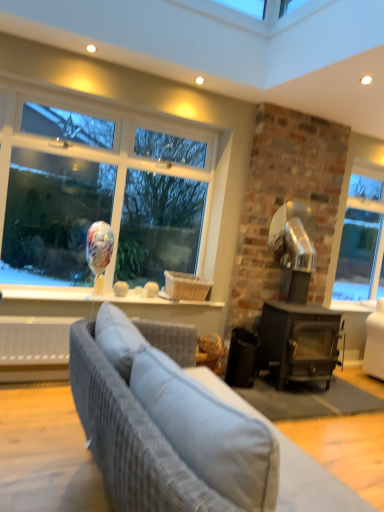
Where is `textured gray fabric couch at lower left`? textured gray fabric couch at lower left is located at coordinates (130, 438).

What do you see at coordinates (130, 438) in the screenshot? This screenshot has height=512, width=384. I see `textured gray fabric couch at lower left` at bounding box center [130, 438].

What is the approximate width of dark gray wood stove at right?

23.01 inches.

Describe the element at coordinates (297, 306) in the screenshot. I see `dark gray wood stove at right` at that location.

The height and width of the screenshot is (512, 384). I want to click on dark gray wood stove at right, so click(297, 306).

What are the coordinates of `textured gray fabric couch at lower left` in the screenshot? It's located at (130, 438).

Would you say dark gray wood stove at right is to the left or to the right of textured gray fabric couch at lower left in the picture?

dark gray wood stove at right is positioned on textured gray fabric couch at lower left's right side.

Which object is further away from the camera, dark gray wood stove at right or textured gray fabric couch at lower left?

dark gray wood stove at right.

Does point (312, 305) lie in front of point (73, 376)?

No, (312, 305) is further to viewer.

From the image's perspective, is dark gray wood stove at right under textured gray fabric couch at lower left?

No, from the image's perspective, dark gray wood stove at right is not beneath textured gray fabric couch at lower left.

From a real-world perspective, does dark gray wood stove at right sit lower than textured gray fabric couch at lower left?

No, from a real-world perspective, dark gray wood stove at right is not below textured gray fabric couch at lower left.

Does dark gray wood stove at right have a lesser width compared to textured gray fabric couch at lower left?

Yes, dark gray wood stove at right is thinner than textured gray fabric couch at lower left.

Who is shorter, dark gray wood stove at right or textured gray fabric couch at lower left?

With less height is textured gray fabric couch at lower left.

Considering the sizes of objects dark gray wood stove at right and textured gray fabric couch at lower left in the image provided, who is bigger, dark gray wood stove at right or textured gray fabric couch at lower left?

With larger size is dark gray wood stove at right.

Can we say dark gray wood stove at right lies outside textured gray fabric couch at lower left?

Absolutely, dark gray wood stove at right is external to textured gray fabric couch at lower left.

Are dark gray wood stove at right and textured gray fabric couch at lower left located far from each other?

Yes.

From the picture: Is dark gray wood stove at right facing towards textured gray fabric couch at lower left?

No, dark gray wood stove at right is not turned towards textured gray fabric couch at lower left.

Can you tell me how much dark gray wood stove at right and textured gray fabric couch at lower left differ in facing direction?

The angular difference between dark gray wood stove at right and textured gray fabric couch at lower left is 0.302 degrees.

How far apart are dark gray wood stove at right and textured gray fabric couch at lower left?

dark gray wood stove at right is 6.79 feet away from textured gray fabric couch at lower left.

Image resolution: width=384 pixels, height=512 pixels. Find the location of `studio couch below the dark gray wood stove at right (from a real-world perspective)`. studio couch below the dark gray wood stove at right (from a real-world perspective) is located at coordinates point(130,438).

Does textured gray fabric couch at lower left appear on the left side of dark gray wood stove at right?

Yes.

Relative to dark gray wood stove at right, is textured gray fabric couch at lower left in front or behind?

Clearly, textured gray fabric couch at lower left is in front of dark gray wood stove at right.

Is point (109, 475) closer to camera compared to point (273, 333)?

Yes.

From the image's perspective, is textured gray fabric couch at lower left below dark gray wood stove at right?

Yes, from the image's perspective, textured gray fabric couch at lower left is below dark gray wood stove at right.

From a real-world perspective, is textured gray fabric couch at lower left physically below dark gray wood stove at right?

Correct, in the physical world, textured gray fabric couch at lower left is lower than dark gray wood stove at right.

Which object is wider, textured gray fabric couch at lower left or dark gray wood stove at right?

textured gray fabric couch at lower left is wider.

Considering the sizes of objects textured gray fabric couch at lower left and dark gray wood stove at right in the image provided, who is taller, textured gray fabric couch at lower left or dark gray wood stove at right?

With more height is dark gray wood stove at right.

Is textured gray fabric couch at lower left smaller than dark gray wood stove at right?

Yes, textured gray fabric couch at lower left is smaller than dark gray wood stove at right.

Is textured gray fabric couch at lower left inside or outside of dark gray wood stove at right?

textured gray fabric couch at lower left is not enclosed by dark gray wood stove at right.

Is textured gray fabric couch at lower left in contact with dark gray wood stove at right?

No.

Does textured gray fabric couch at lower left turn towards dark gray wood stove at right?

No, textured gray fabric couch at lower left is not oriented towards dark gray wood stove at right.

What's the angular difference between textured gray fabric couch at lower left and dark gray wood stove at right's facing directions?

The angular difference between textured gray fabric couch at lower left and dark gray wood stove at right is 0.302 degrees.

Identify the location of fireplace behind the textured gray fabric couch at lower left. (297, 306).

You are a GUI agent. You are given a task and a screenshot of the screen. Output one action in this format:
    pyautogui.click(x=<x>, y=<y>)
    Task: Click on the fireplace that appears on the right of textured gray fabric couch at lower left
    
    Given the screenshot: What is the action you would take?
    pyautogui.click(x=297, y=306)

Image resolution: width=384 pixels, height=512 pixels. I want to click on fireplace lying behind the textured gray fabric couch at lower left, so click(x=297, y=306).